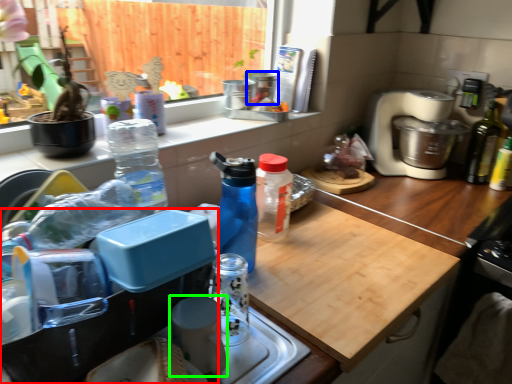
Question: Which object is positioned closest to kitchen appliance (highlighted by a red box)? Select from appliance (highlighted by a blue box) and appliance (highlighted by a green box).

Choices:
 (A) appliance
 (B) appliance

Answer: (B)